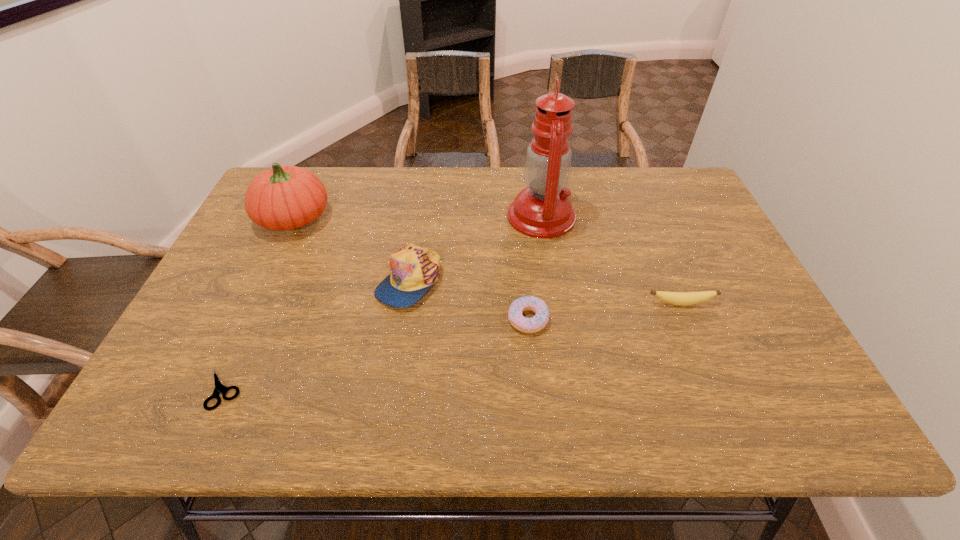
I want to click on object situated at the far left corner, so click(x=284, y=197).

Where is `object positioned at the near left corner`? The image size is (960, 540). object positioned at the near left corner is located at coordinates (219, 388).

Identify the location of vacant space at the far edge. (454, 166).

Identify the location of free space at the right edge of the desktop. This screenshot has width=960, height=540. (784, 355).

Locate an element on the screen. The height and width of the screenshot is (540, 960). vacant area that lies between the rightmost object and the doughnut is located at coordinates (604, 312).

Find the location of a particular element. Image resolution: width=960 pixels, height=540 pixels. free space between the shears and the rightmost object is located at coordinates (452, 346).

Find the location of a particular element. vacant space in between the cap and the pumpkin is located at coordinates (351, 249).

Locate an element on the screen. Image resolution: width=960 pixels, height=540 pixels. empty location between the rightmost object and the fifth shortest object is located at coordinates (487, 261).

I want to click on vacant space that's between the second tallest object and the nearest object, so click(x=258, y=304).

You are a GUI agent. You are given a task and a screenshot of the screen. Output one action in this format:
    pyautogui.click(x=<x>, y=<y>)
    Task: Click on the object that can be found as the fourth closest to the fourth object from right to left
    
    Given the screenshot: What is the action you would take?
    pyautogui.click(x=219, y=388)